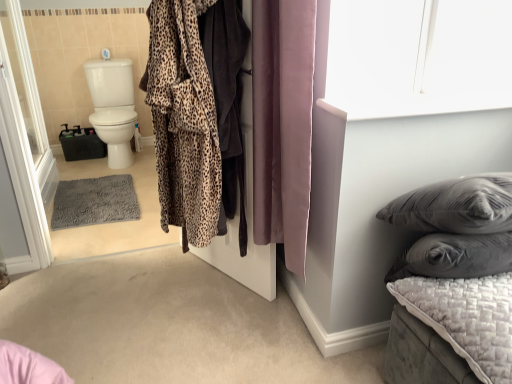
Question: Is quilted gray cushion at lower right smaller than purple velvet curtain at center?

Choices:
 (A) yes
 (B) no

Answer: (A)

Question: Is quilted gray cushion at lower right facing away from purple velvet curtain at center?

Choices:
 (A) yes
 (B) no

Answer: (B)

Question: Can you confirm if quilted gray cushion at lower right is shorter than purple velvet curtain at center?

Choices:
 (A) no
 (B) yes

Answer: (B)

Question: From the image's perspective, is quilted gray cushion at lower right under purple velvet curtain at center?

Choices:
 (A) yes
 (B) no

Answer: (A)

Question: Is quilted gray cushion at lower right outside purple velvet curtain at center?

Choices:
 (A) no
 (B) yes

Answer: (B)

Question: In the image, is quilted gray cushion at lower right on the left side or the right side of transparent glass screen door at left?

Choices:
 (A) right
 (B) left

Answer: (A)

Question: Is point (442, 360) closer or farther from the camera than point (33, 193)?

Choices:
 (A) closer
 (B) farther

Answer: (A)

Question: Looking at their shapes, would you say quilted gray cushion at lower right is wider or thinner than transparent glass screen door at left?

Choices:
 (A) thin
 (B) wide

Answer: (B)

Question: Considering their positions, is quilted gray cushion at lower right located in front of or behind transparent glass screen door at left?

Choices:
 (A) behind
 (B) front

Answer: (B)

Question: From a real-world perspective, relative to quilted gray cushion at lower right, is quilted gray mattress at lower right vertically above or below?

Choices:
 (A) above
 (B) below

Answer: (B)

Question: From their relative heights in the image, would you say quilted gray mattress at lower right is taller or shorter than quilted gray cushion at lower right?

Choices:
 (A) tall
 (B) short

Answer: (A)

Question: Is quilted gray mattress at lower right wider or thinner than quilted gray cushion at lower right?

Choices:
 (A) thin
 (B) wide

Answer: (A)

Question: From the image's perspective, is quilted gray mattress at lower right located above or below quilted gray cushion at lower right?

Choices:
 (A) below
 (B) above

Answer: (A)

Question: Is point tap(194, 215) closer or farther from the camera than point tap(13, 177)?

Choices:
 (A) farther
 (B) closer

Answer: (B)

Question: From a real-world perspective, is leopard print plush bathrobe at center positioned above or below transparent glass screen door at left?

Choices:
 (A) below
 (B) above

Answer: (B)